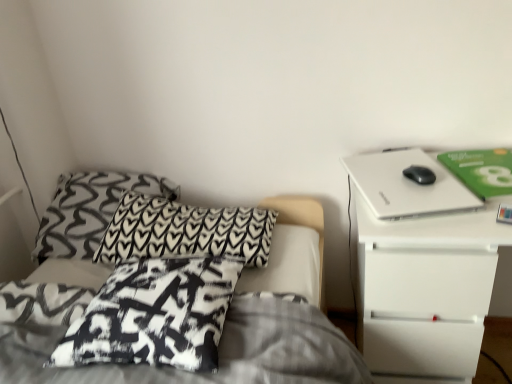
What are the coordinates of `vacant area located to the right-hand side of black matte mouse at right` in the screenshot? It's located at (442, 173).